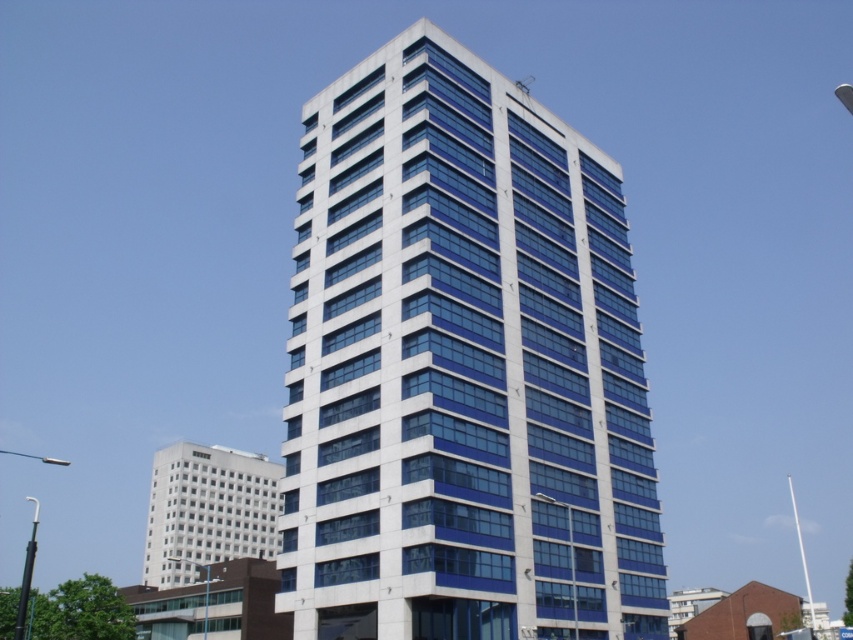
Based on the photo, you are an architect analyzing the layout of a city block. You observe the white glass building at center and the white glass building at lower left. Based on their sizes, which one is more likely to be the newer architectural design?

The white glass building at center is smaller than the white glass building at lower left. Since newer buildings often incorporate modern designs and may be scaled down for aesthetic or functional reasons, the smaller size of the white glass building at center suggests it might be the newer architectural design.

You are an architect evaluating the spatial layout of the city. You notice the white glass building at center and the white glass building at lower left. Which building has a narrower width from your viewpoint?

The white glass building at center is thinner than the white glass building at lower left, so the white glass building at center has a narrower width from your viewpoint.